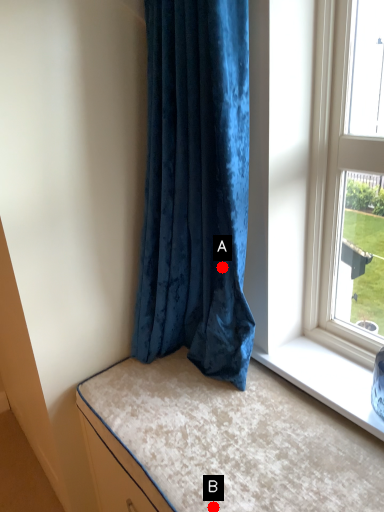
Question: Two points are circled on the image, labeled by A and B beside each circle. Which point is farther from the camera taking this photo?

Choices:
 (A) A is further
 (B) B is further

Answer: (A)